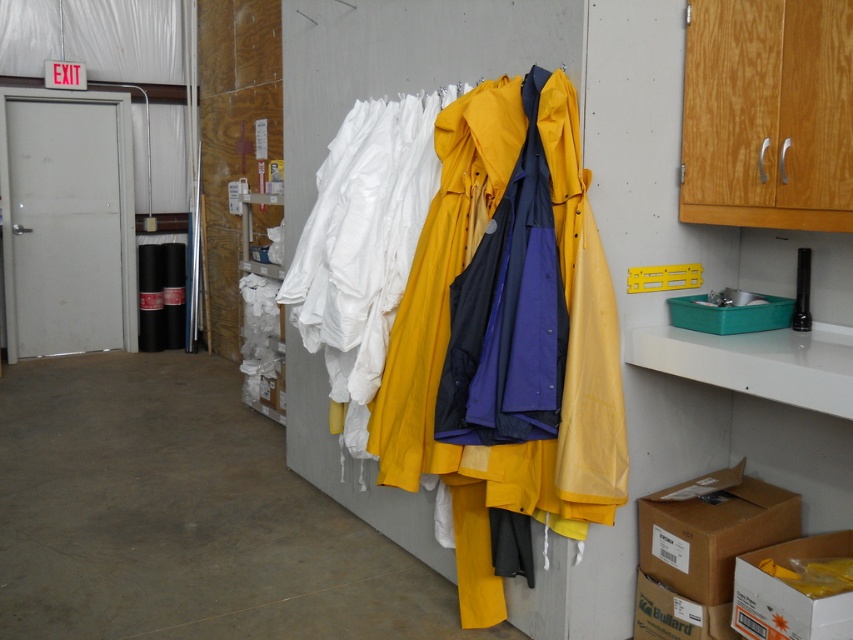
Who is positioned more to the right, yellow matte raincoat at center or brown cardboard box at lower right?

From the viewer's perspective, brown cardboard box at lower right appears more on the right side.

Can you confirm if yellow matte raincoat at center is shorter than brown cardboard box at lower right?

Incorrect, yellow matte raincoat at center's height does not fall short of brown cardboard box at lower right's.

Is point (444, 451) positioned in front of point (753, 525)?

Yes, it is.

The height and width of the screenshot is (640, 853). Find the location of `yellow matte raincoat at center`. yellow matte raincoat at center is located at coordinates (445, 353).

The width and height of the screenshot is (853, 640). What do you see at coordinates (788, 593) in the screenshot? I see `white cardboard box at lower right` at bounding box center [788, 593].

Who is more forward, (762,612) or (697,605)?

Point (762,612) is more forward.

Find the location of a particular element. The width and height of the screenshot is (853, 640). white cardboard box at lower right is located at coordinates (788, 593).

Is brown cardboard box at lower right above white cardboard box at lower right?

Correct, brown cardboard box at lower right is located above white cardboard box at lower right.

Is brown cardboard box at lower right further to camera compared to white cardboard box at lower right?

Yes, brown cardboard box at lower right is further from the viewer.

The width and height of the screenshot is (853, 640). What do you see at coordinates (711, 531) in the screenshot?
I see `brown cardboard box at lower right` at bounding box center [711, 531].

At what (x,y) coordinates should I click in order to perform the action: click on brown cardboard box at lower right. Please return your answer as a coordinate pair (x, y). Image resolution: width=853 pixels, height=640 pixels. Looking at the image, I should click on (711, 531).